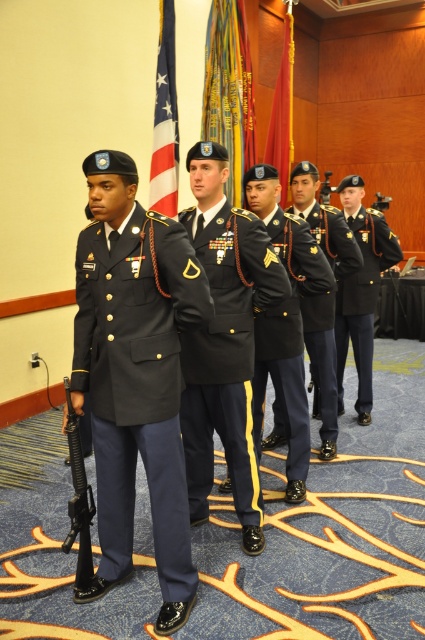
Question: In this image, where is black matte uniform at right located relative to silky cotton flag at center?

Choices:
 (A) right
 (B) left

Answer: (A)

Question: Can you confirm if black matte uniform at center is bigger than silk flag at center?

Choices:
 (A) no
 (B) yes

Answer: (A)

Question: Which object appears closest to the camera in this image?

Choices:
 (A) navy blue fabric uniform at left
 (B) black matte uniform at center
 (C) red velvet flag at upper center
 (D) silk flag at center

Answer: (A)

Question: Which point appears closest to the camera in this image?

Choices:
 (A) (78, 502)
 (B) (277, 154)

Answer: (A)

Question: Which object appears closest to the camera in this image?

Choices:
 (A) dark green fabric uniform at center
 (B) black matte uniform at center
 (C) navy blue fabric uniform at left
 (D) black matte uniform at right

Answer: (C)

Question: Can you confirm if shiny black uniform at center is positioned to the left of silk flag at center?

Choices:
 (A) no
 (B) yes

Answer: (A)